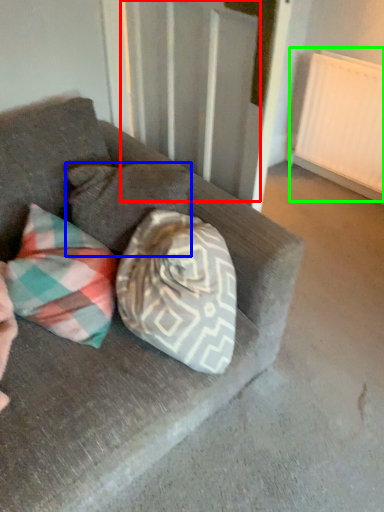
Question: Which is farther away from curtain (highlighted by a red box)? pillow (highlighted by a blue box) or radiator (highlighted by a green box)?

Choices:
 (A) pillow
 (B) radiator

Answer: (B)